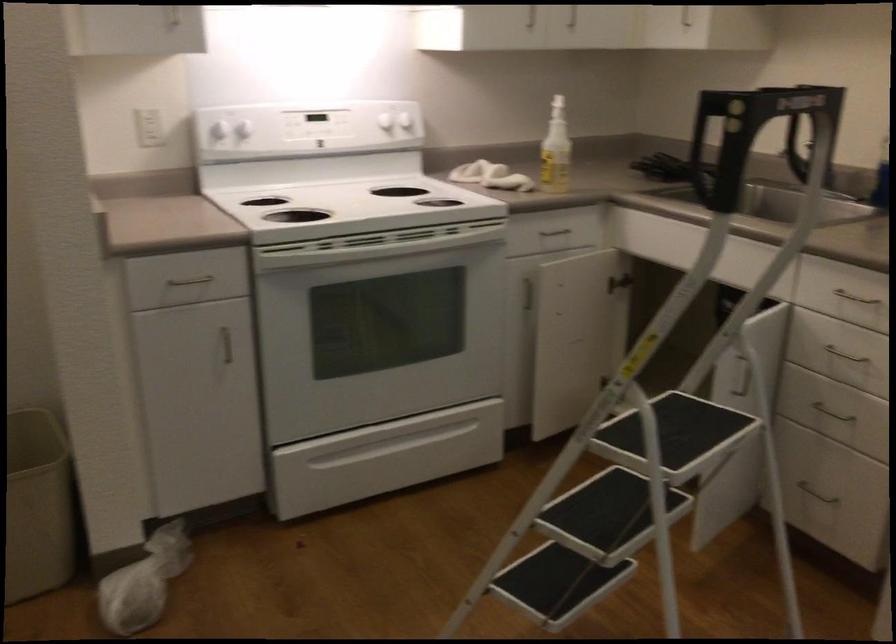
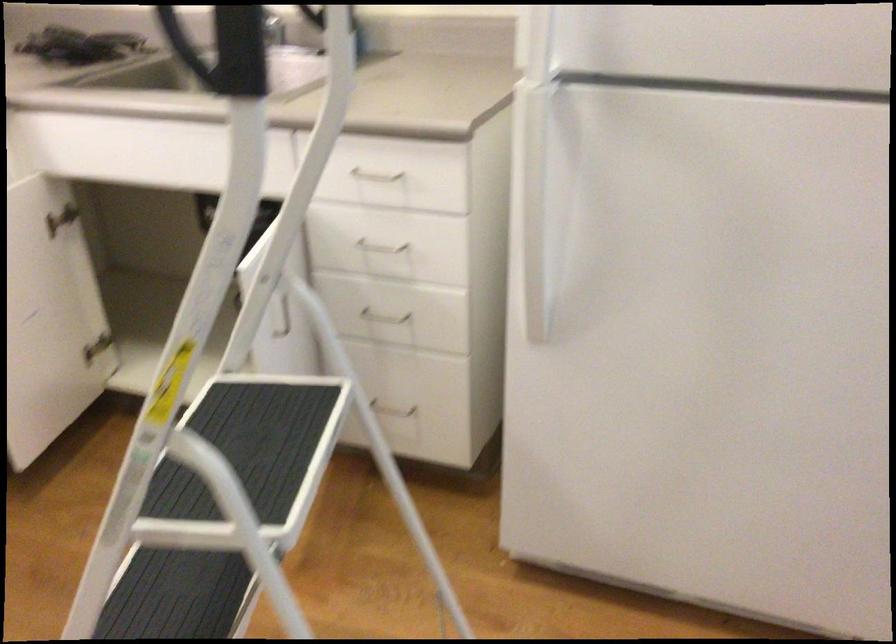
The point at (692, 431) is marked in the first image. Where is the corresponding point in the second image?

(247, 448)